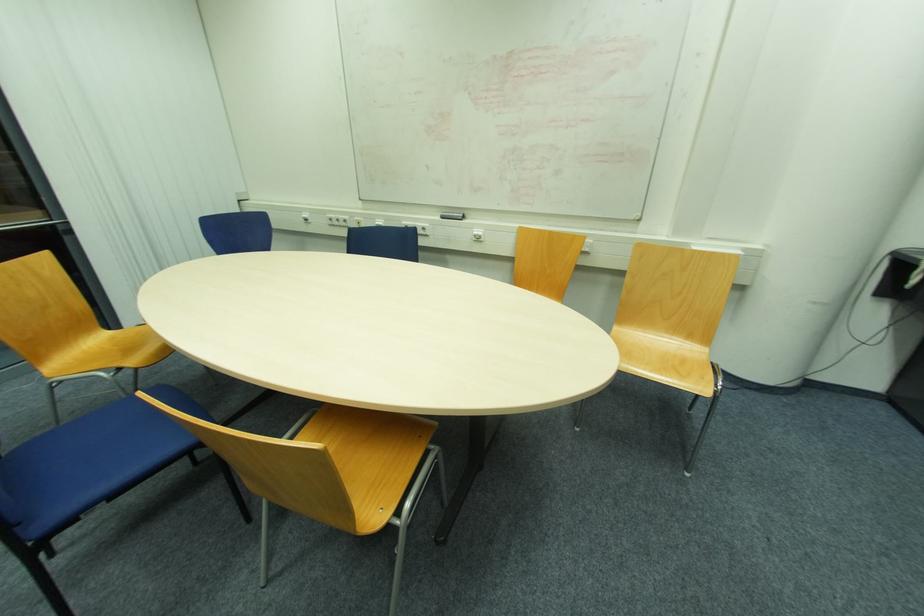
This screenshot has width=924, height=616. In order to click on blue chair sitting surface in this screenshot , I will do `click(82, 461)`.